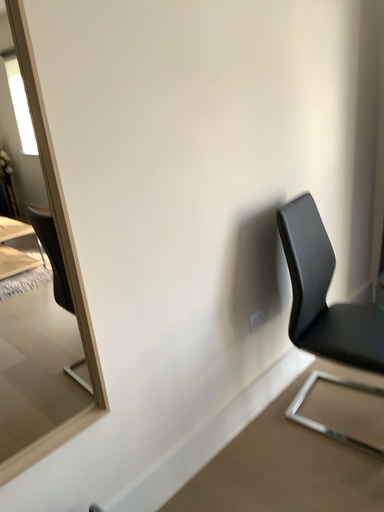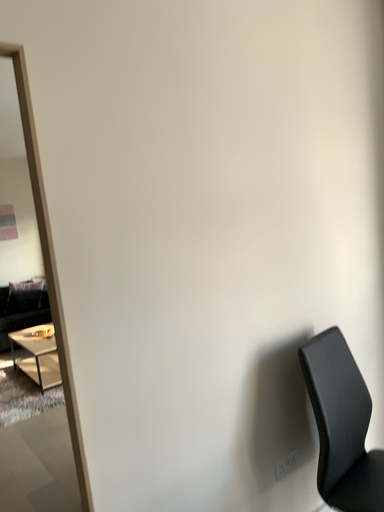
Question: How did the camera likely rotate when shooting the video?

Choices:
 (A) rotated right
 (B) rotated left

Answer: (B)